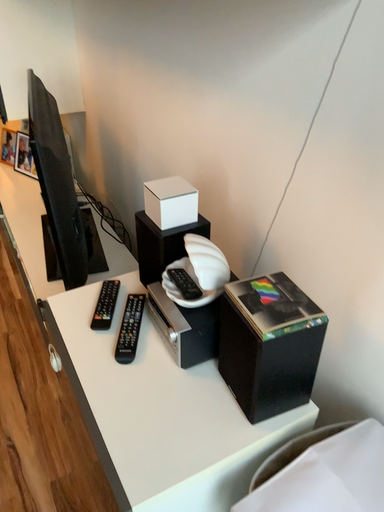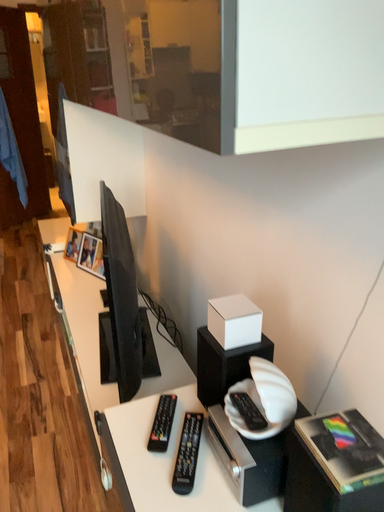
Question: Which way did the camera rotate in the video?

Choices:
 (A) rotated downward
 (B) rotated upward

Answer: (B)